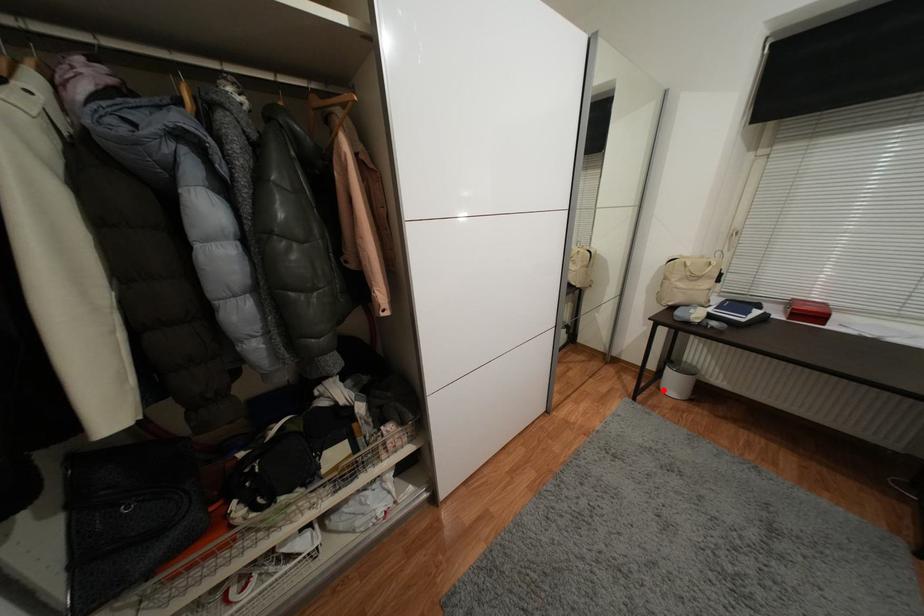
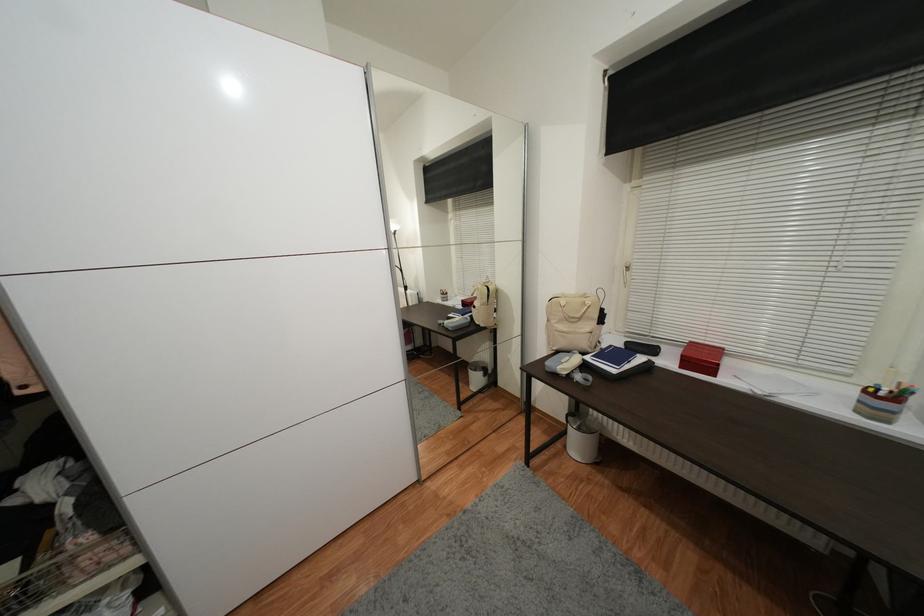
Question: I am providing you with two images of the same scene from different viewpoints. A red point is marked on the first image. Can you still see the location of the red point in image 2?

Choices:
 (A) Yes
 (B) No

Answer: (A)